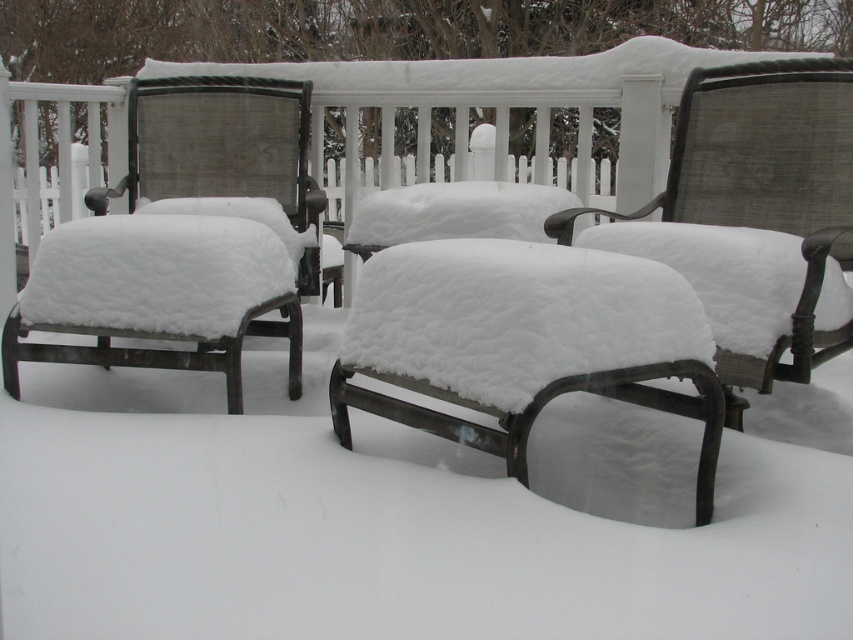
Question: Which point is farther from the camera taking this photo?

Choices:
 (A) (553, 228)
 (B) (169, 132)
 (C) (498, 387)

Answer: (B)

Question: Can you confirm if matte black chair at left is thinner than metallic mesh chair at center?

Choices:
 (A) no
 (B) yes

Answer: (A)

Question: Which of the following is the farthest from the observer?

Choices:
 (A) matte black chair at left
 (B) snow-covered metal bench at center
 (C) metallic mesh chair at center

Answer: (A)

Question: Which of the following is the farthest from the observer?

Choices:
 (A) (216, 104)
 (B) (630, 237)
 (C) (621, 376)

Answer: (A)

Question: Is snow-covered metal bench at center bigger than metallic mesh chair at center?

Choices:
 (A) no
 (B) yes

Answer: (A)

Question: Observing the image, what is the correct spatial positioning of snow-covered metal bench at center in reference to metallic mesh chair at center?

Choices:
 (A) left
 (B) right

Answer: (A)